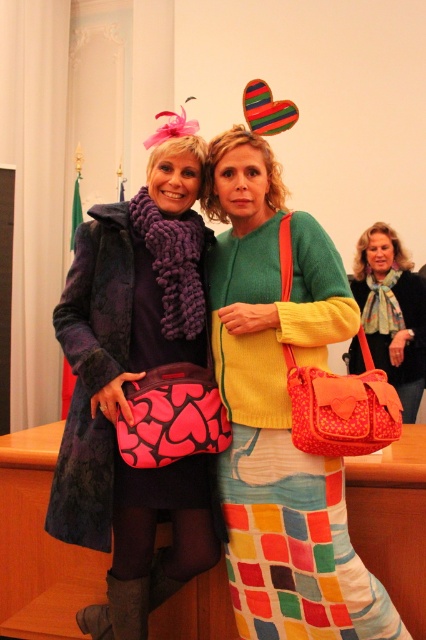
You are a photographer trying to capture a closeup of the matte purple scarf at left and the matte pink purse at center. Which object should you zoom in on first to ensure it fits properly in the frame?

The matte purple scarf at left has a greater height compared to the matte pink purse at center, so you should zoom in on the matte purple scarf at left first to ensure it fits properly in the frame.

You are a photographer setting up for a group photo. You need to position the multicolored textured skirt at center and the matte pink purse at center correctly based on their current positions. Which object should be placed to the right to align with their original positions?

The matte pink purse at center should be placed to the right of the multicolored textured skirt at center because the multicolored textured skirt at center is currently to the left of the matte pink purse at center.

You are a photographer at the event and need to adjust your camera to focus on the multicolored textured skirt at center and the matte pink purse at center. Which object should you focus on first to ensure both are in focus?

The multicolored textured skirt at center is in front of the matte pink purse at center, so you should focus on the matte pink purse at center first to ensure both are in focus.